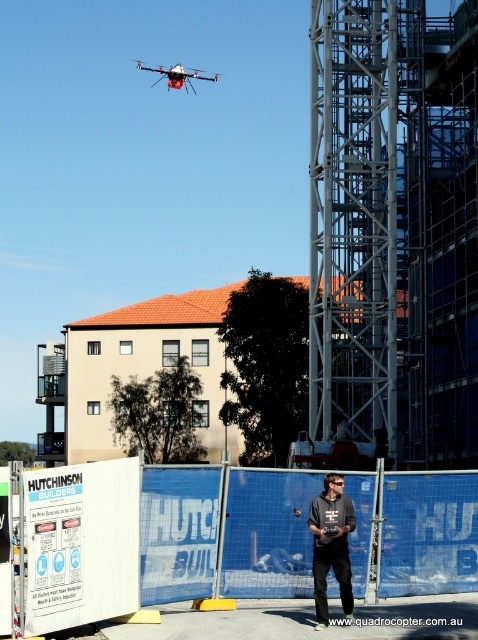
You are a safety inspector at the construction site. You notice the dark gray shirt at center and the white matte drone at upper center. Which object is narrower from your viewpoint?

The dark gray shirt at center has a lesser width compared to the white matte drone at upper center, so the dark gray shirt at center is narrower.

Looking at this image, you are a safety inspector at the construction site. You notice the dark gray shirt at center and the white matte drone at upper center in your field of view. Which object is closer to the ground?

The dark gray shirt at center has a lesser height compared to the white matte drone at upper center, so the dark gray shirt at center is closer to the ground.

You are a safety inspector at the construction site. You notice the dark gray shirt at center and the white matte drone at upper center. Which object is larger in the image?

The white matte drone at upper center is larger than the dark gray shirt at center.